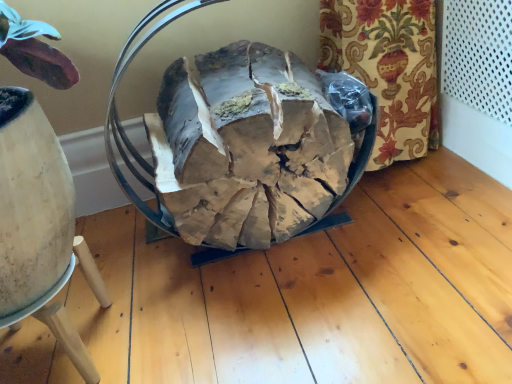
Question: Does natural wood firewood at center appear on the right side of wooden stool at lower left?

Choices:
 (A) no
 (B) yes

Answer: (B)

Question: Does natural wood firewood at center have a lesser width compared to wooden stool at lower left?

Choices:
 (A) no
 (B) yes

Answer: (A)

Question: Does natural wood firewood at center lie behind wooden stool at lower left?

Choices:
 (A) no
 (B) yes

Answer: (B)

Question: From the image's perspective, is natural wood firewood at center above wooden stool at lower left?

Choices:
 (A) no
 (B) yes

Answer: (B)

Question: From the image's perspective, would you say natural wood firewood at center is shown under wooden stool at lower left?

Choices:
 (A) no
 (B) yes

Answer: (A)

Question: Can you confirm if natural wood firewood at center is smaller than wooden stool at lower left?

Choices:
 (A) no
 (B) yes

Answer: (A)

Question: Is wooden stool at lower left looking in the opposite direction of natural wood firewood at center?

Choices:
 (A) yes
 (B) no

Answer: (B)

Question: Does wooden stool at lower left lie in front of natural wood firewood at center?

Choices:
 (A) yes
 (B) no

Answer: (A)

Question: Is wooden stool at lower left facing towards natural wood firewood at center?

Choices:
 (A) no
 (B) yes

Answer: (A)

Question: Is wooden stool at lower left further to camera compared to natural wood firewood at center?

Choices:
 (A) no
 (B) yes

Answer: (A)

Question: Would you consider wooden stool at lower left to be distant from natural wood firewood at center?

Choices:
 (A) no
 (B) yes

Answer: (A)

Question: Considering the relative positions of wooden stool at lower left and natural wood firewood at center in the image provided, is wooden stool at lower left to the left of natural wood firewood at center from the viewer's perspective?

Choices:
 (A) yes
 (B) no

Answer: (A)

Question: From the image's perspective, relative to natural wood firewood at center, is wooden stool at lower left above or below?

Choices:
 (A) above
 (B) below

Answer: (B)